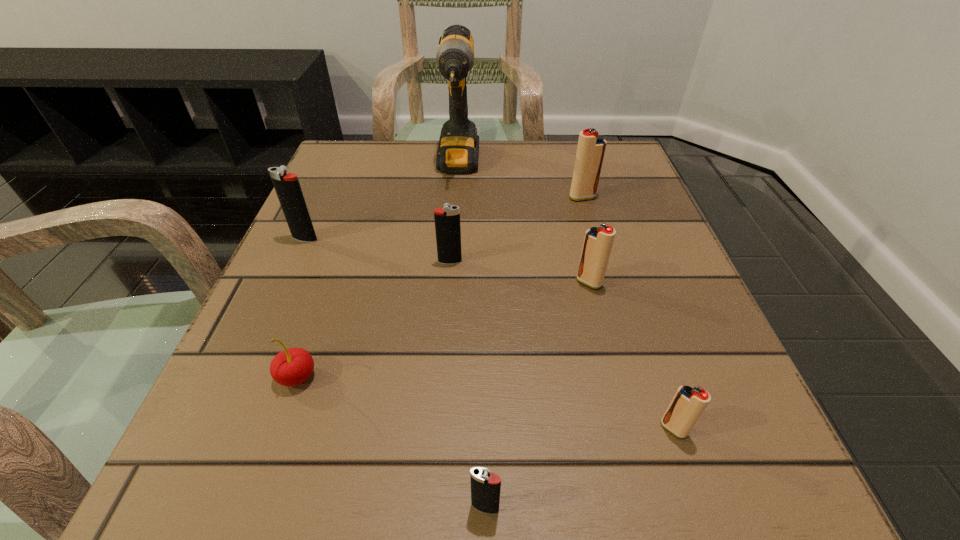
The image size is (960, 540). What are the coordinates of `the third closest red igniter to the tallest object` in the screenshot? It's located at coord(687,405).

At what (x,y) coordinates should I click in order to perform the action: click on the second closest black igniter to the nearest object. Please return your answer as a coordinate pair (x, y). Looking at the image, I should click on tap(287, 186).

Where is `black igniter that is the second closest to the sixth farthest object`? This screenshot has width=960, height=540. black igniter that is the second closest to the sixth farthest object is located at coordinates (485, 486).

I want to click on free space that satisfies the following two spatial constraints: 1. with the drill bit of the tallest object facing forward; 2. on the right side of the third nearest igniter, so click(450, 282).